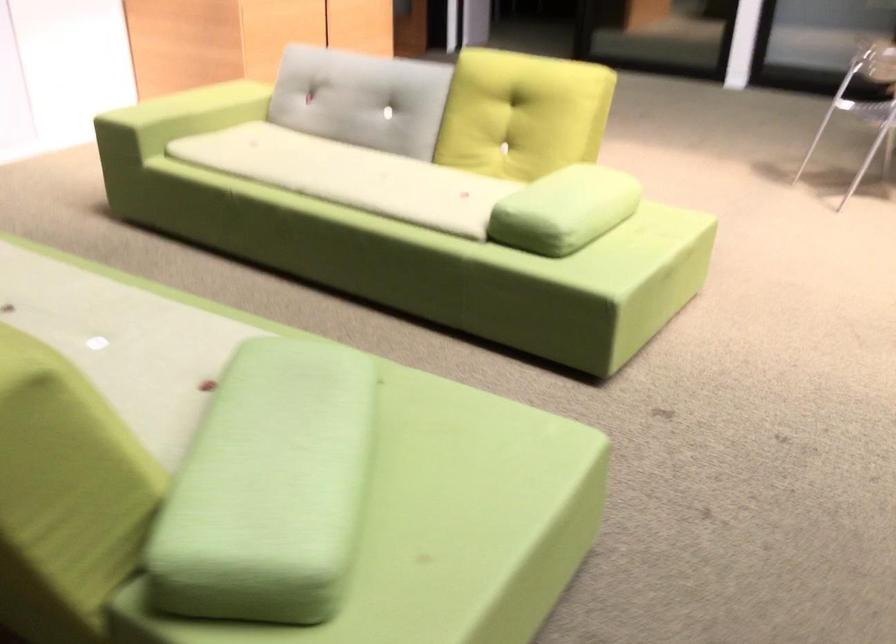
Locate an element on the screen. Image resolution: width=896 pixels, height=644 pixels. chair sitting surface is located at coordinates (886, 67).